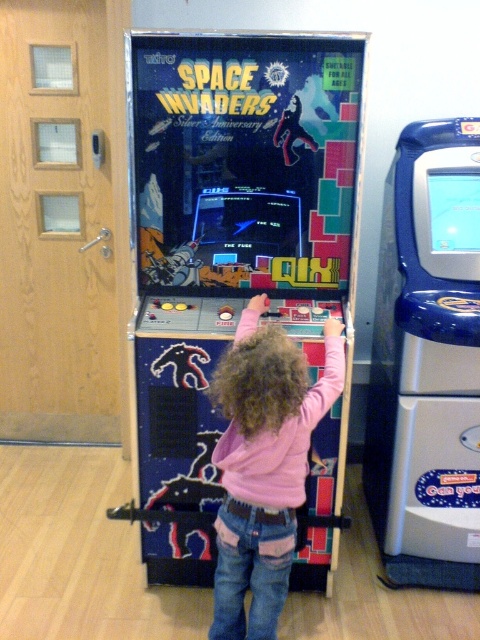
You are a photographer trying to capture a clear shot of the Space Invaders arcade machine. You notice two points on the machine at coordinates point (398,337) and point (249,480). Which point is closer to the camera?

Point (249,480) is closer to the camera than point (398,337).

You are a parent trying to find your child who is playing the Space Invaders game. You see the pink fleece at center and the blue plastic vending machine at right. Which object is closer to the Space Invaders game machine?

The pink fleece at center is closer to the Space Invaders game machine because the blue plastic vending machine at right is located to the right of it.